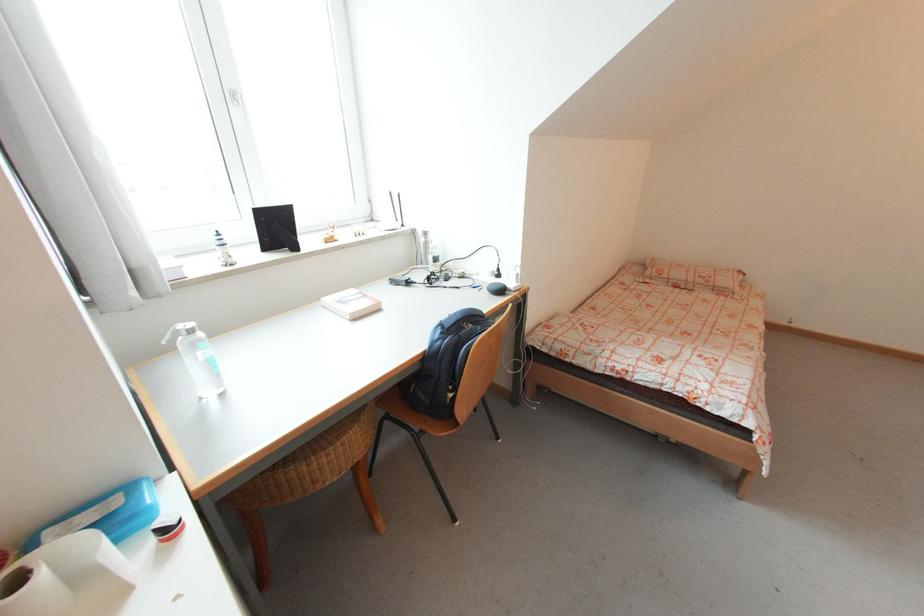
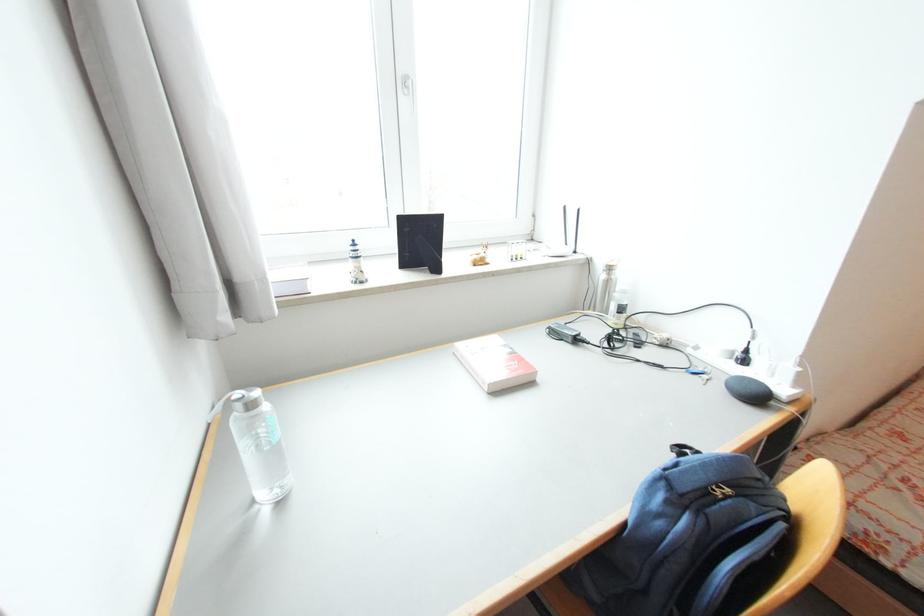
Locate, in the second image, the point that corresponds to point (355, 315) in the first image.

(493, 386)